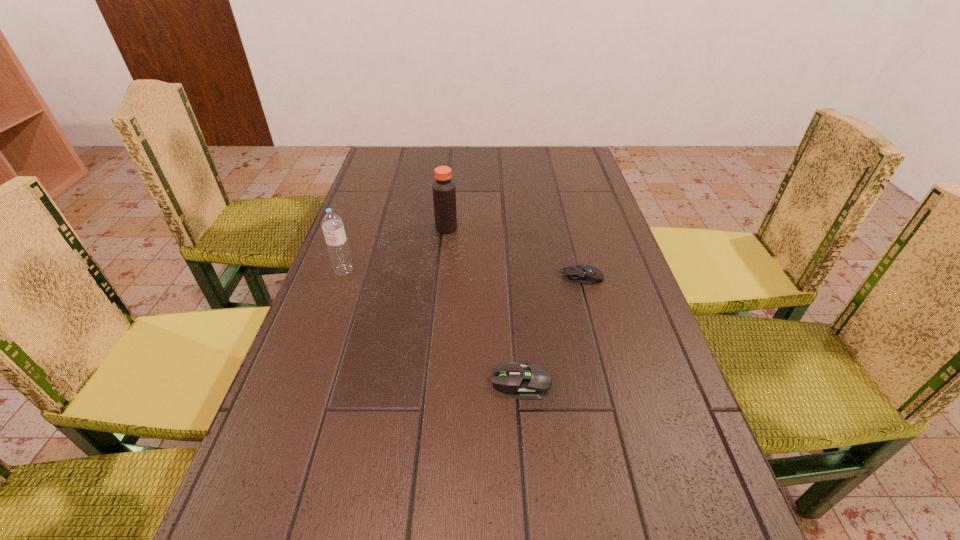
Where is `empty space between the third object from right to left and the farther computer mouse`? empty space between the third object from right to left and the farther computer mouse is located at coordinates (513, 253).

The height and width of the screenshot is (540, 960). Identify the location of free space between the rightmost object and the left computer mouse. (550, 329).

The width and height of the screenshot is (960, 540). Identify the location of vacant space in between the leftmost object and the rightmost object. (462, 274).

Where is `free space between the right computer mouse and the water bottle`? The width and height of the screenshot is (960, 540). free space between the right computer mouse and the water bottle is located at coordinates (462, 274).

You are a GUI agent. You are given a task and a screenshot of the screen. Output one action in this format:
    pyautogui.click(x=<x>, y=<y>)
    Task: Click on the vacant region between the farther computer mouse and the second object from left to right
    The image size is (960, 540).
    Given the screenshot: What is the action you would take?
    click(x=513, y=253)

I want to click on unoccupied position between the right computer mouse and the second object from right to left, so click(550, 329).

At what (x,y) coordinates should I click in order to perform the action: click on free area in between the leftmost object and the right computer mouse. Please return your answer as a coordinate pair (x, y). Looking at the image, I should click on (462, 274).

Identify which object is the third nearest to the left computer mouse. Please provide its 2D coordinates. Your answer should be formatted as a tuple, i.e. [(x, y)], where the tuple contains the x and y coordinates of a point satisfying the conditions above.

[(444, 192)]

Identify which object is the closest to the water bottle. Please provide its 2D coordinates. Your answer should be formatted as a tuple, i.e. [(x, y)], where the tuple contains the x and y coordinates of a point satisfying the conditions above.

[(444, 192)]

Find the location of a particular element. The image size is (960, 540). vacant space that satisfies the following two spatial constraints: 1. on the front side of the water bottle; 2. on the left side of the right computer mouse is located at coordinates (342, 277).